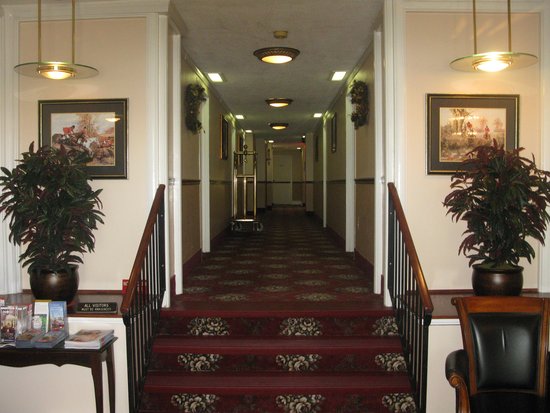
Where is `plant vase`? This screenshot has height=413, width=550. plant vase is located at coordinates (53, 284), (503, 275).